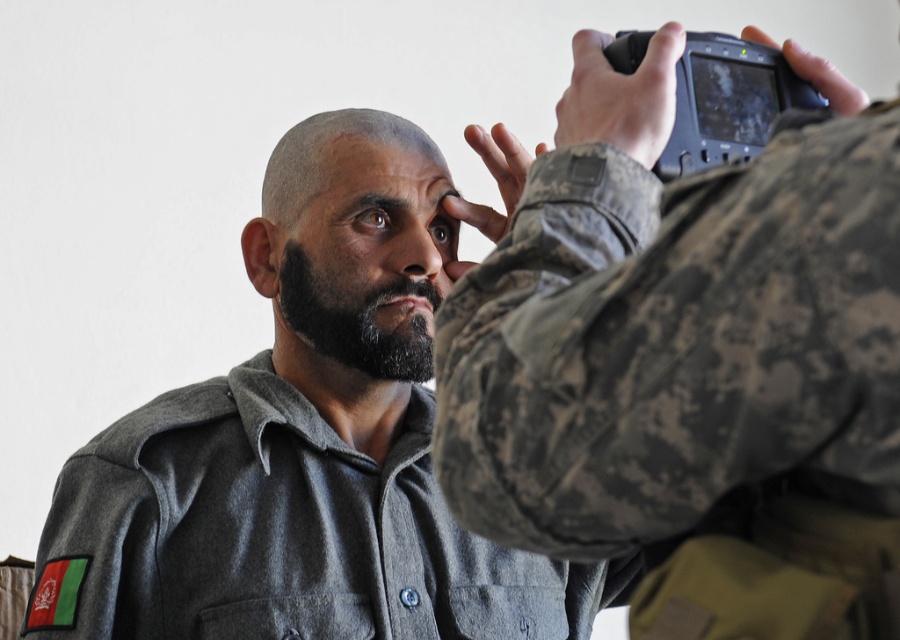
You are a delivery robot that needs to place a package between the camouflage fabric at upper right and the gray matte shirt at center. The package is 18 inches long. Can you fit it between them without moving either object?

The camouflage fabric at upper right and gray matte shirt at center are 19.29 inches apart from each other. Since the package is 18 inches long, it can fit between them as there is enough space.

You are a photographer trying to capture a clear photo of the gray matte shirt at center without including the camouflage fabric at upper right in the frame. Based on their positions, is this possible?

The camouflage fabric at upper right is above the gray matte shirt at center, so if you position your camera to focus on the lower part of the gray matte shirt at center, you can exclude the camouflage fabric at upper right from the frame.

You are a photographer trying to capture a portrait of the gray matte shirt at center. To ensure the camouflage fabric at upper right doesn not distract the viewer, should you position yourself to the left or right of the subject?

You should position yourself to the left of the gray matte shirt at center because the camouflage fabric at upper right is located to the right of the gray matte shirt at center, so moving left would place the camouflage fabric at upper right out of frame or less visible.